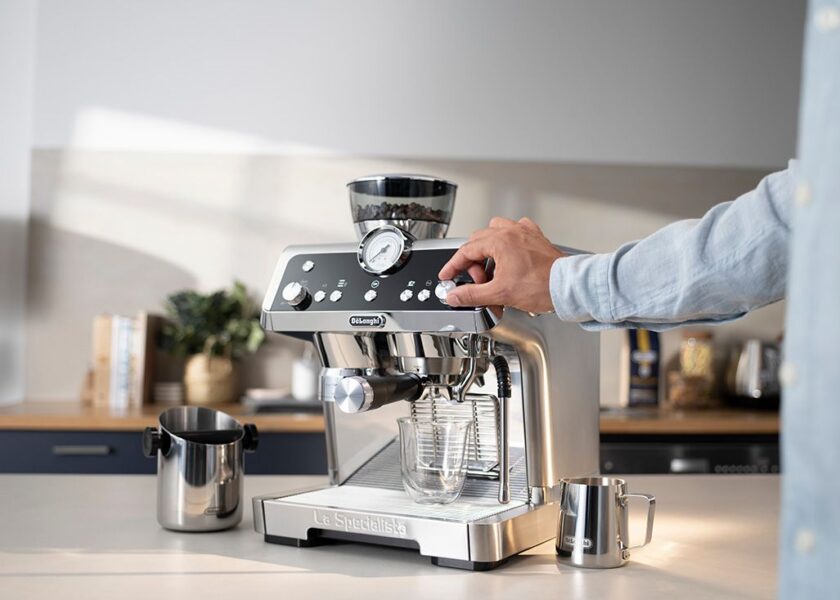
Locate an element on the screen. espresso machine is located at coordinates (347, 291).